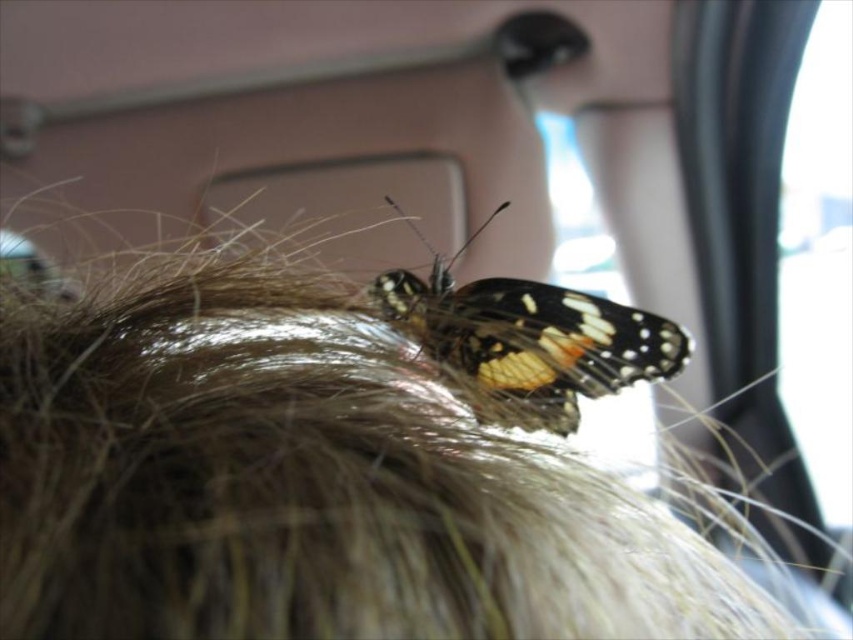
Between point (45, 442) and point (428, 285), which one is positioned in front?

Positioned in front is point (45, 442).

Between brown fuzzy hair at upper center and shiny orange butterfly at center, which one is positioned higher?

shiny orange butterfly at center

This screenshot has width=853, height=640. Identify the location of brown fuzzy hair at upper center. (305, 484).